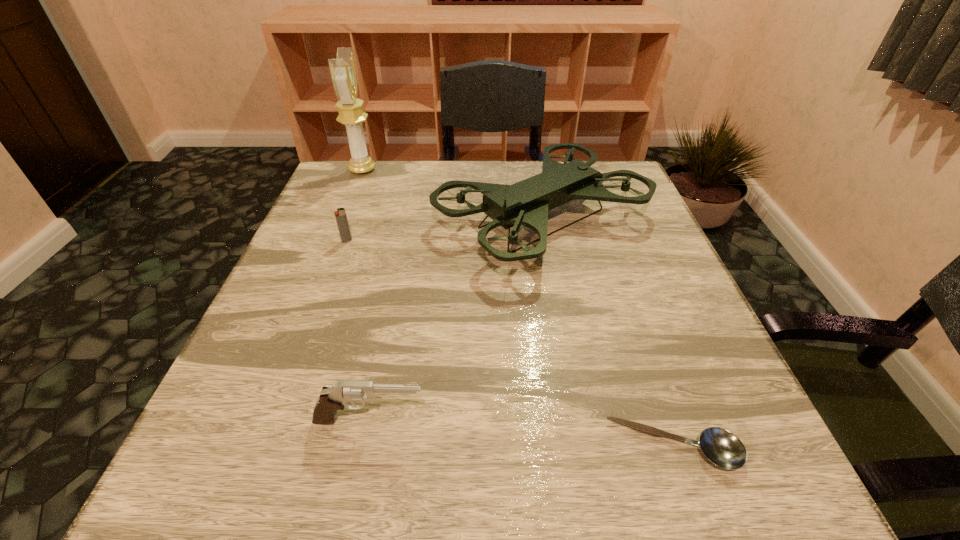
Find the location of `vacant position in the image that satisfies the following two spatial constraints: 1. on the front side of the second shortest object; 2. on the left side of the ladle`. vacant position in the image that satisfies the following two spatial constraints: 1. on the front side of the second shortest object; 2. on the left side of the ladle is located at coordinates (271, 447).

At what (x,y) coordinates should I click in order to perform the action: click on vacant area in the image that satisfies the following two spatial constraints: 1. on the front side of the second shortest object; 2. on the right side of the ladle. Please return your answer as a coordinate pair (x, y). The image size is (960, 540). Looking at the image, I should click on (271, 447).

Find the location of a particular element. free space in the image that satisfies the following two spatial constraints: 1. on the front side of the fourth shortest object; 2. at the muzzle of the third tallest object is located at coordinates (579, 420).

At what (x,y) coordinates should I click in order to perform the action: click on free space that satisfies the following two spatial constraints: 1. on the front side of the drone; 2. at the muzzle of the third shortest object. Please return your answer as a coordinate pair (x, y). The image size is (960, 540). Looking at the image, I should click on (579, 420).

The height and width of the screenshot is (540, 960). Find the location of `vacant region that satisfies the following two spatial constraints: 1. on the front-facing side of the award; 2. on the left side of the second shortest object`. vacant region that satisfies the following two spatial constraints: 1. on the front-facing side of the award; 2. on the left side of the second shortest object is located at coordinates (334, 241).

Where is `vacant space that satisfies the following two spatial constraints: 1. on the front-facing side of the tallest object; 2. on the left side of the ladle`? The width and height of the screenshot is (960, 540). vacant space that satisfies the following two spatial constraints: 1. on the front-facing side of the tallest object; 2. on the left side of the ladle is located at coordinates (251, 447).